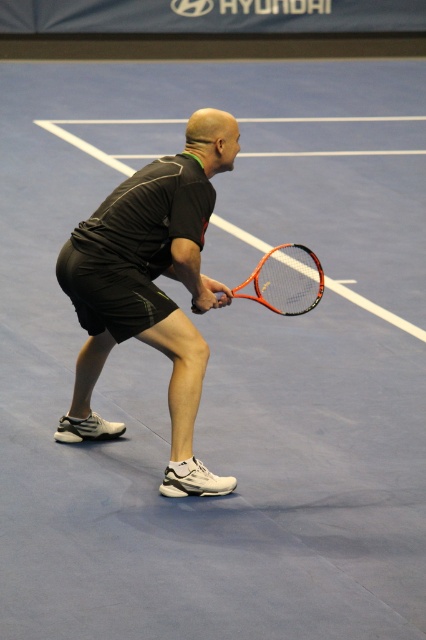
Between black matte tennis racket at center and orange carbon fiber tennis racket at center, which one is positioned lower?

Positioned lower is black matte tennis racket at center.

Between black matte tennis racket at center and orange carbon fiber tennis racket at center, which one appears on the left side from the viewer's perspective?

black matte tennis racket at center is more to the left.

Which is in front, point (95, 291) or point (245, 292)?

Positioned in front is point (95, 291).

I want to click on black matte tennis racket at center, so click(150, 285).